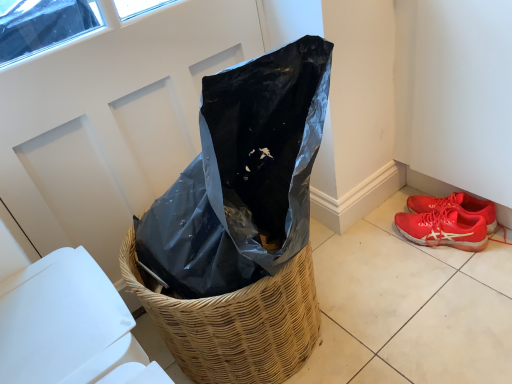
This screenshot has height=384, width=512. What are the coordinates of `vacant point to the left of shiny red sneakers at lower right` in the screenshot? It's located at (384, 264).